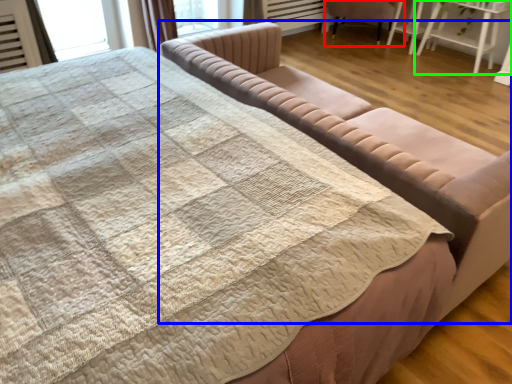
Question: Which is nearer to the chair (highlighted by a red box)? studio couch (highlighted by a blue box) or table (highlighted by a green box).

Choices:
 (A) studio couch
 (B) table

Answer: (B)